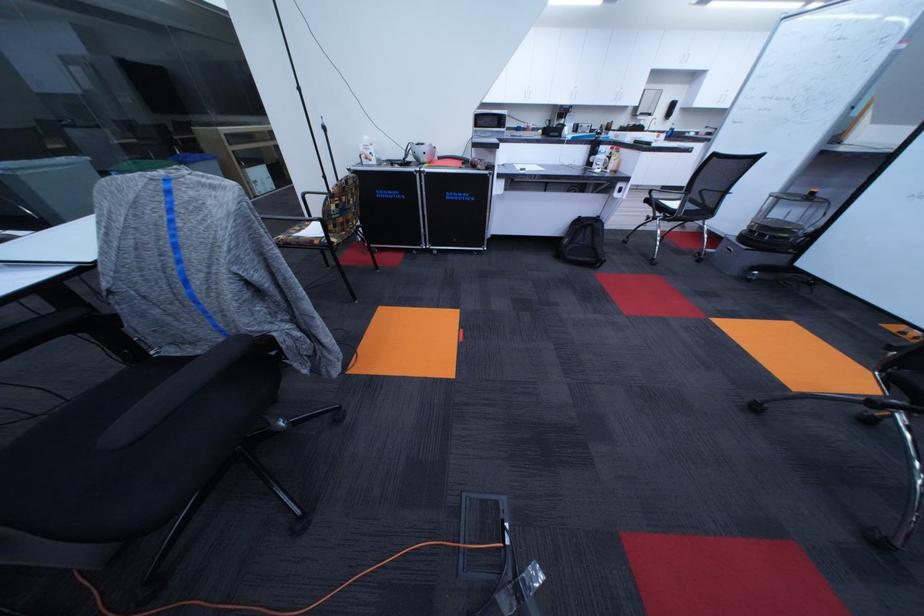
What do you see at coordinates (96, 471) in the screenshot?
I see `a black chair sitting surface` at bounding box center [96, 471].